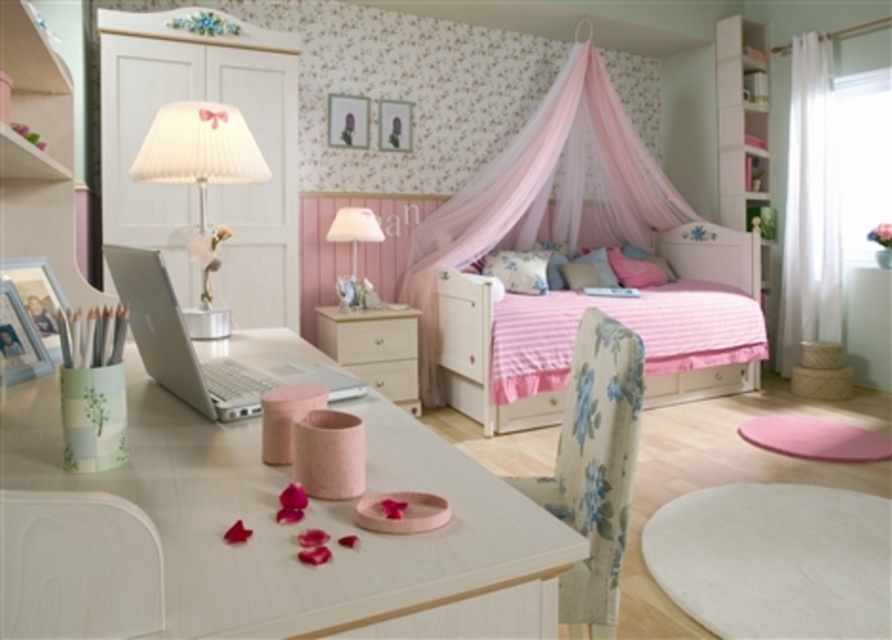
Question: Is floral fabric chair at center below white glossy drawer at center?

Choices:
 (A) no
 (B) yes

Answer: (A)

Question: Among these points, which one is farthest from the camera?

Choices:
 (A) (157, 132)
 (B) (139, 554)

Answer: (A)

Question: Considering the real-world distances, which object is closest to the white glossy drawer at center?

Choices:
 (A) silver metallic laptop at center
 (B) white wood dresser at right

Answer: (B)

Question: Where is pink striped bed at center located in relation to white pleated fabric lampshade at upper left in the image?

Choices:
 (A) right
 (B) left

Answer: (A)

Question: Which is farther from the white wood table at center?

Choices:
 (A) matte white drawer at center
 (B) matte white lamp at center
 (C) white pleated fabric lampshade at upper left
 (D) white wood dresser at right

Answer: (D)

Question: Is the position of pink fabric canopy bed at center more distant than that of white glossy chair at lower left?

Choices:
 (A) no
 (B) yes

Answer: (B)